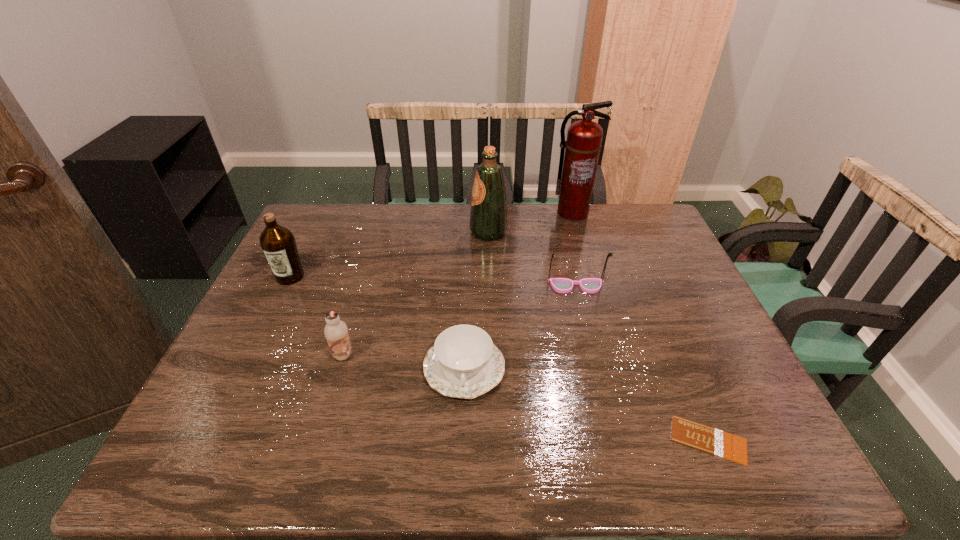
Identify the location of free space between the chocolate milk and the spectacles. The image size is (960, 540). (460, 321).

Find the location of a particular element. The image size is (960, 540). free area in between the taller olive oil and the nearer olive oil is located at coordinates (390, 254).

Locate an element on the screen. This screenshot has height=540, width=960. the second closest object relative to the left olive oil is located at coordinates (464, 363).

Point out which object is positioned as the fifth nearest to the tallest object. Please provide its 2D coordinates. Your answer should be formatted as a tuple, i.e. [(x, y)], where the tuple contains the x and y coordinates of a point satisfying the conditions above.

[(336, 332)]

At what (x,y) coordinates should I click in order to perform the action: click on free space that satisfies the following two spatial constraints: 1. on the front-facing side of the farther olive oil; 2. on the handle side of the sixth tallest object. Please return your answer as a coordinate pair (x, y). This screenshot has height=540, width=960. Looking at the image, I should click on [492, 368].

In order to click on free space that satisfies the following two spatial constraints: 1. on the front side of the shortest object; 2. on the left side of the second object from left to right in this screenshot , I will do `click(319, 440)`.

Identify the location of free region that satisfies the following two spatial constraints: 1. on the front side of the second object from left to right; 2. on the left side of the shortest object. (319, 440).

Locate an element on the screen. The image size is (960, 540). free point that satisfies the following two spatial constraints: 1. on the handle side of the shortest object; 2. on the left side of the sixth tallest object is located at coordinates (462, 440).